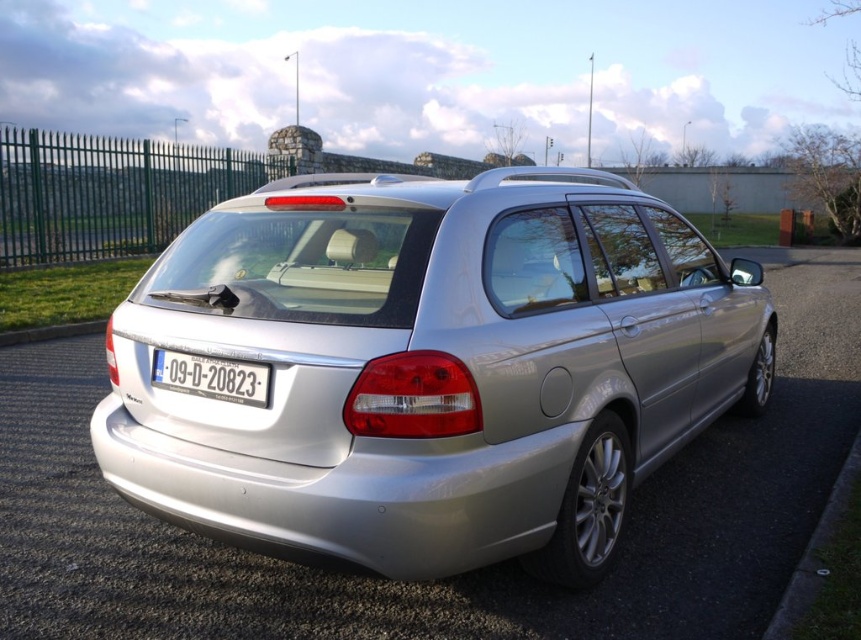
You are standing at the point with coordinates 0.6, 0.5. You want to walk to the silver metallic car at center. Which direction should you move?

Since the silver metallic car at center is located at point (x=431, y=368) and you are at (x=430, y=384), you should move slightly to the left and down to reach it.

You are a delivery driver who needs to park your vehicle between the green metal fence at left and the black asphalt curb at lower right. Can you fit your 2.5 meter wide delivery truck between them?

The green metal fence at left is positioned on the left side of black asphalt curb at lower right. The distance between them is not specified, so it is impossible to determine if the 2.5 meter wide delivery truck can fit. Please check the actual space available.